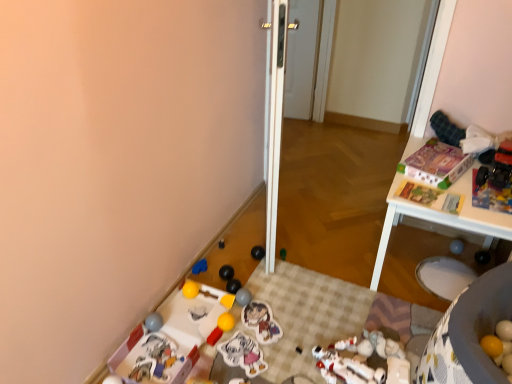
This screenshot has height=384, width=512. I want to click on vacant space in between matte plastic sticker at center, placed as the 11th toy when sorted from left to right, and white matte robot at lower center, the 15th toy viewed from the left, so click(x=286, y=353).